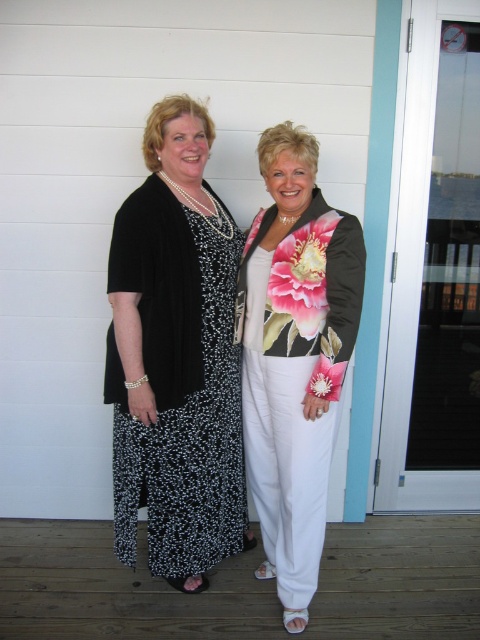
Two women are standing against a white wooden wall. The first woman is wearing a black cardigan over a black and white patterned dress, and the second woman is in a black jacket with a large floral design. A point is located at coordinates point (170, 620). If you were to walk from the first woman to this point, would you pass by the second woman?

The two women are 2.04 meters apart. Since the point is at coordinates point (170, 620), it is necessary to determine the spatial relationship between their positions. However, without specific coordinate details about their exact locations, it is impossible to accurately determine if walking from the first woman to the point would involve passing the second woman. The answer cannot be definitively concluded with the provided information.

You are a photographer setting up a shoot. You need to decide which outfit to feature based on their sizes. The scene has limited space. The outfits are the black dotted dress at left and the floral satin jacket at center. Which outfit requires more space due to its size?

The black dotted dress at left requires more space because its width is larger than the floral satin jacket at center.